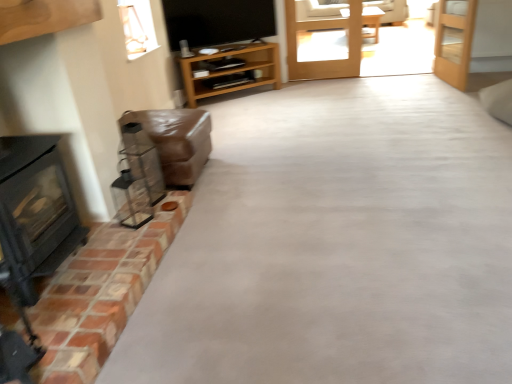
Question: Would you say brown leather couch at left is a long distance from wooden shelf at center?

Choices:
 (A) no
 (B) yes

Answer: (B)

Question: From a real-world perspective, does brown leather couch at left sit lower than wooden shelf at center?

Choices:
 (A) no
 (B) yes

Answer: (B)

Question: Is the depth of brown leather couch at left less than that of wooden shelf at center?

Choices:
 (A) yes
 (B) no

Answer: (A)

Question: Is brown leather couch at left outside wooden shelf at center?

Choices:
 (A) yes
 (B) no

Answer: (A)

Question: Does brown leather couch at left have a smaller size compared to wooden shelf at center?

Choices:
 (A) no
 (B) yes

Answer: (B)

Question: Is point (347, 36) positioned closer to the camera than point (28, 192)?

Choices:
 (A) closer
 (B) farther

Answer: (B)

Question: From a real-world perspective, is clear glass door at center, acting as the first door starting from the left, positioned above or below black matte wood burning stove at left?

Choices:
 (A) below
 (B) above

Answer: (A)

Question: In the image, is clear glass door at center, the second door in the right-to-left sequence, on the left side or the right side of black matte wood burning stove at left?

Choices:
 (A) left
 (B) right

Answer: (B)

Question: Is clear glass door at center, the second door in the right-to-left sequence, wider or thinner than black matte wood burning stove at left?

Choices:
 (A) wide
 (B) thin

Answer: (B)

Question: Which is correct: light brown wooden table at center is inside brown leather couch at left, or outside of it?

Choices:
 (A) outside
 (B) inside

Answer: (A)

Question: Looking at their shapes, would you say light brown wooden table at center is wider or thinner than brown leather couch at left?

Choices:
 (A) thin
 (B) wide

Answer: (B)

Question: Based on their positions, is light brown wooden table at center located to the left or right of brown leather couch at left?

Choices:
 (A) right
 (B) left

Answer: (A)

Question: From a real-world perspective, is light brown wooden table at center physically located above or below brown leather couch at left?

Choices:
 (A) below
 (B) above

Answer: (B)

Question: Choose the correct answer: Is wooden door at upper right, which is the first door in right-to-left order, inside clear glass door at center, the second door in the right-to-left sequence, or outside it?

Choices:
 (A) outside
 (B) inside

Answer: (A)

Question: Looking at their shapes, would you say wooden door at upper right, which is the first door in right-to-left order, is wider or thinner than clear glass door at center, the second door in the right-to-left sequence?

Choices:
 (A) wide
 (B) thin

Answer: (A)